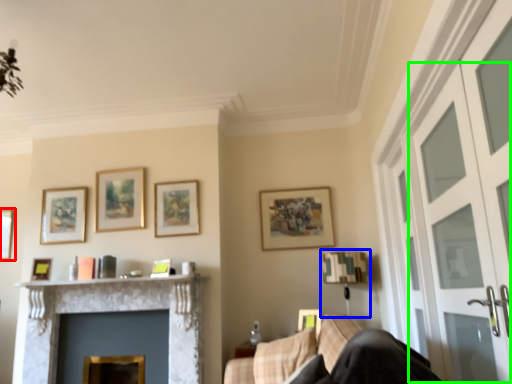
Question: Which object is the farthest from picture frame (highlighted by a red box)? Choose among these: lamp (highlighted by a blue box) or screen door (highlighted by a green box).

Choices:
 (A) lamp
 (B) screen door

Answer: (B)